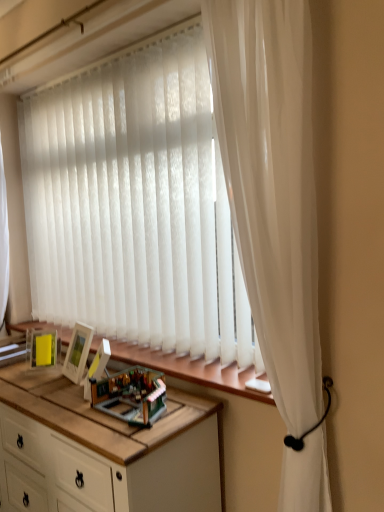
Find the location of `free space that is to the left of translucent plastic toy at center`. free space that is to the left of translucent plastic toy at center is located at coordinates (79, 411).